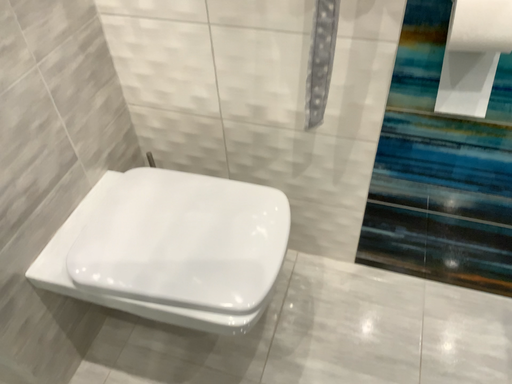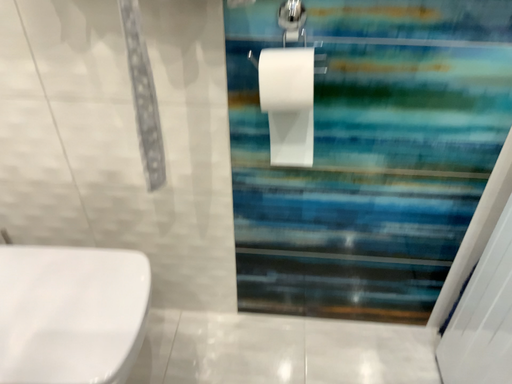
Question: How did the camera likely rotate when shooting the video?

Choices:
 (A) rotated downward
 (B) rotated upward

Answer: (B)